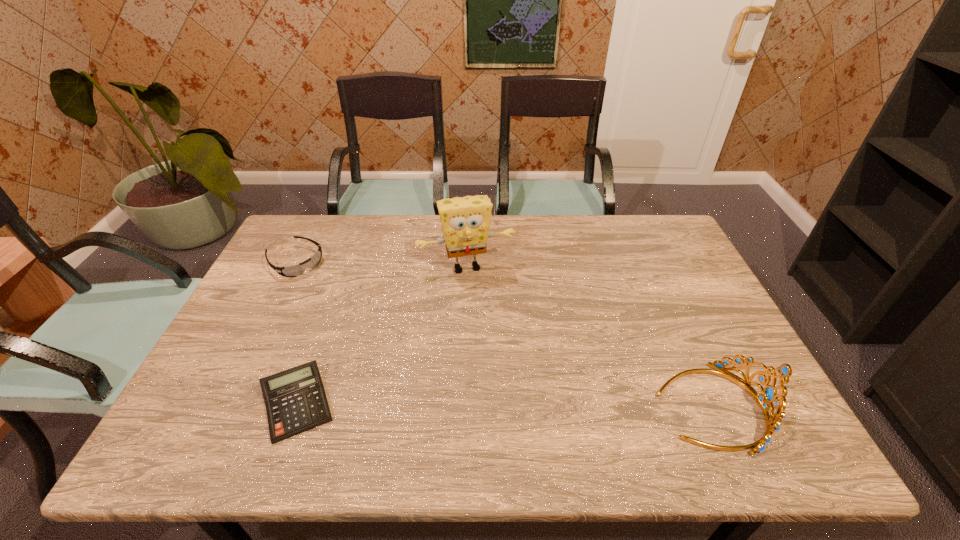
The image size is (960, 540). What are the coordinates of `vacant space located 0.300m on the face of the tallest object` in the screenshot? It's located at (501, 356).

Where is `free region located on the face of the tallest object`? This screenshot has width=960, height=540. free region located on the face of the tallest object is located at coordinates (511, 386).

You are a GUI agent. You are given a task and a screenshot of the screen. Output one action in this format:
    pyautogui.click(x=<x>, y=<y>)
    Task: Click on the vacant space located on the face of the tallest object
    The image size is (960, 540).
    Given the screenshot: What is the action you would take?
    pyautogui.click(x=491, y=322)

Where is `sunglasses that is at the far edge`? The image size is (960, 540). sunglasses that is at the far edge is located at coordinates (297, 270).

Find the location of `sponge that is positioned at the far edge`. sponge that is positioned at the far edge is located at coordinates (465, 221).

You are a GUI agent. You are given a task and a screenshot of the screen. Output one action in this format:
    pyautogui.click(x=<x>, y=<y>)
    Task: Click on the calculator that is at the near edge
    
    Given the screenshot: What is the action you would take?
    pyautogui.click(x=295, y=399)

Identify the location of tiara that is at the near edge. This screenshot has height=540, width=960. pos(769,395).

In order to click on calculator that is at the left edge in this screenshot , I will do `click(295, 399)`.

Identify the location of sunglasses present at the left edge. This screenshot has width=960, height=540. (297, 270).

Identify the location of object that is positioned at the right edge. (769, 395).